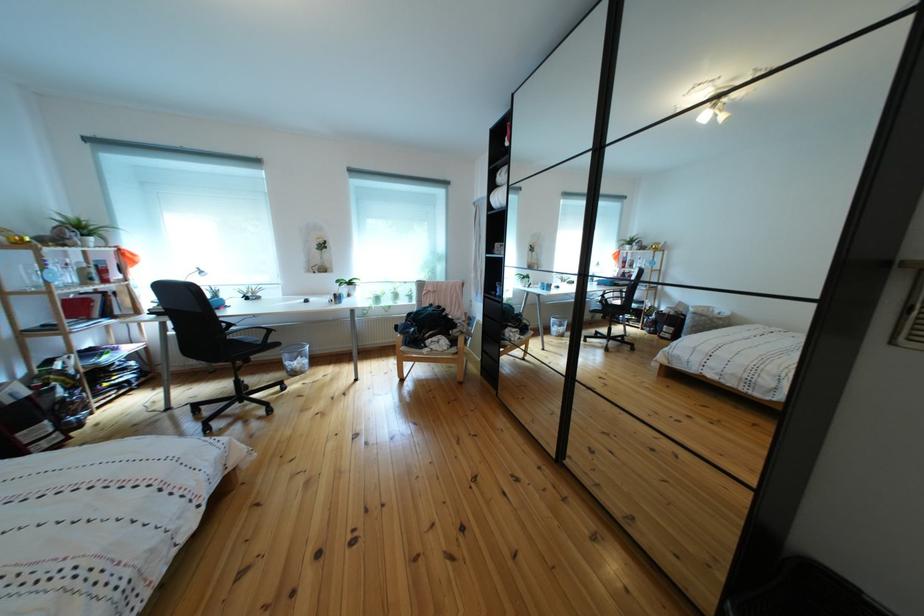
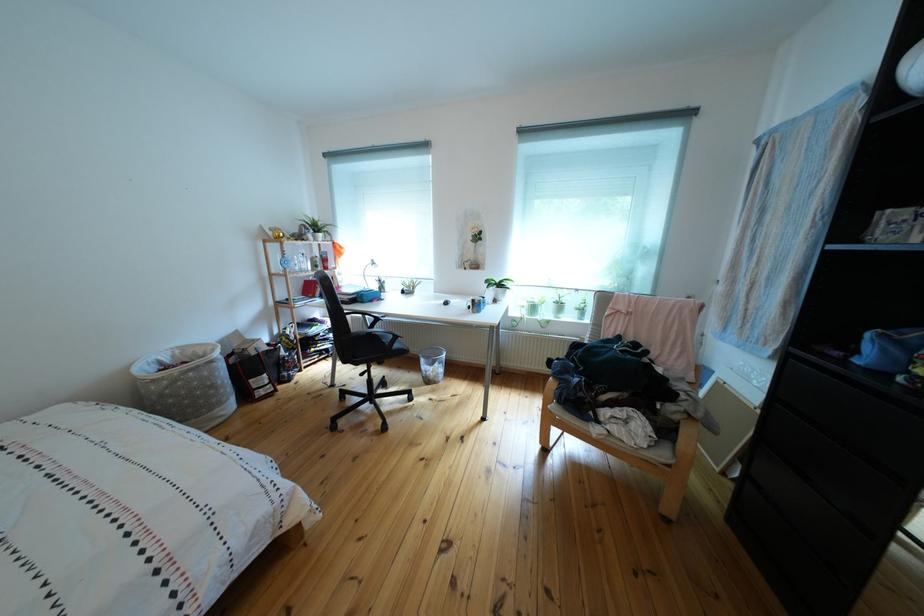
Question: The camera is either moving clockwise (left) or counter-clockwise (right) around the object. The first image is from the beginning of the video and the second image is from the end. Is the camera moving left or right when shooting the video?

Choices:
 (A) Left
 (B) Right

Answer: (B)